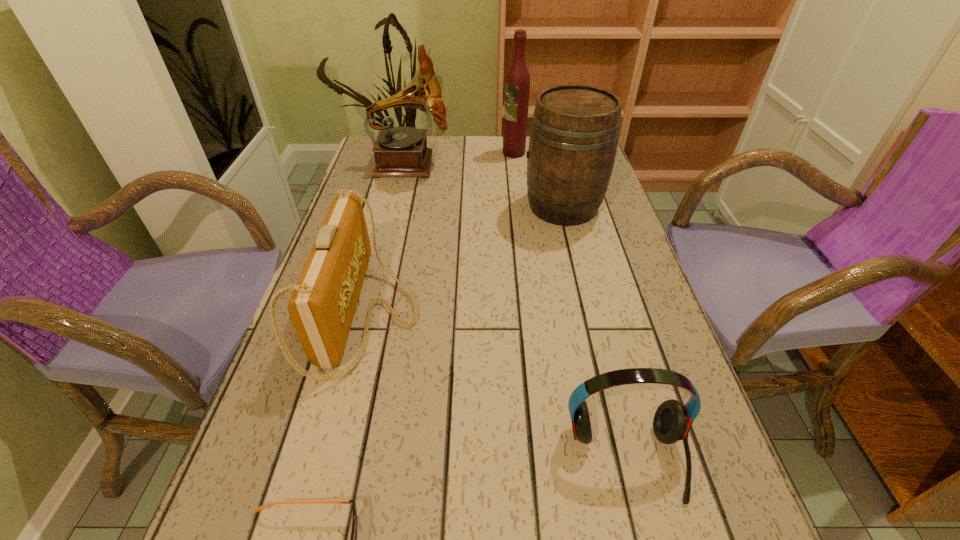
At what (x,y) coordinates should I click in order to perform the action: click on vacant region located on the label of the liquor. Please return your answer as a coordinate pair (x, y). Looking at the image, I should click on (456, 153).

This screenshot has width=960, height=540. In order to click on free region located on the horn of the phonograph_record in this screenshot , I will do `click(537, 164)`.

Where is `vacant space located 0.250m on the side of the cider near the bung hole`? This screenshot has height=540, width=960. vacant space located 0.250m on the side of the cider near the bung hole is located at coordinates (431, 206).

Where is `free space located 0.320m on the side of the cider near the bung hole`? This screenshot has height=540, width=960. free space located 0.320m on the side of the cider near the bung hole is located at coordinates (405, 206).

Find the location of a particular element. Image resolution: width=960 pixels, height=540 pixels. free spot located on the side of the cider near the bung hole is located at coordinates (379, 206).

Identify the location of vacant region located 0.290m on the decorative side of the third nearest object. (559, 315).

Locate an element on the screen. liquor at the far edge is located at coordinates (517, 84).

This screenshot has width=960, height=540. Identify the location of phonograph_record located in the far edge section of the desktop. (401, 152).

You are a GUI agent. You are given a task and a screenshot of the screen. Output one action in this format:
    pyautogui.click(x=<x>, y=<y>)
    Task: Click on the phonograph_record located at the left edge
    This screenshot has height=540, width=960.
    Given the screenshot: What is the action you would take?
    pyautogui.click(x=401, y=152)

The image size is (960, 540). Find the location of `handbag that is positioned at the left edge`. handbag that is positioned at the left edge is located at coordinates (322, 306).